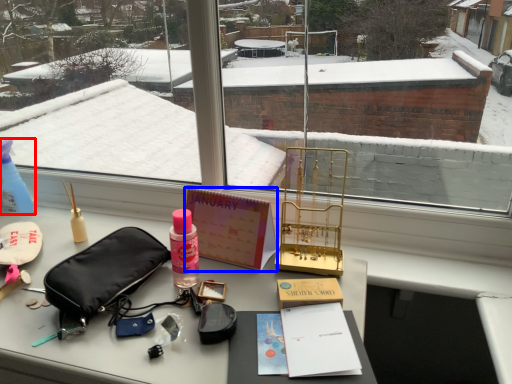
Question: Which object is closer to the camera taking this photo, bottle (highlighted by a red box) or book (highlighted by a blue box)?

Choices:
 (A) bottle
 (B) book

Answer: (B)